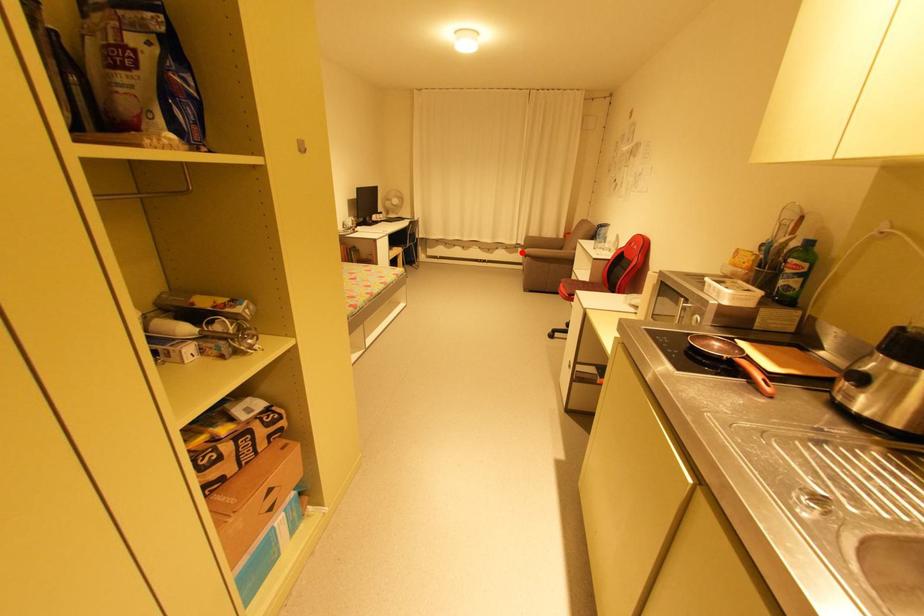
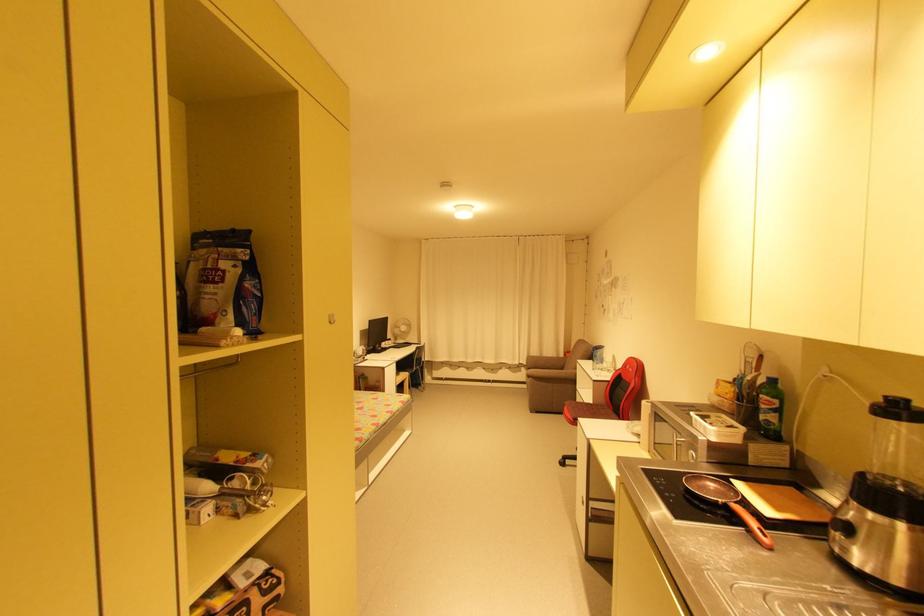
Question: I am providing you with two images of the same scene from different viewpoints. Given a red point in image1, look at the same physical point in image2. Is it:

Choices:
 (A) Closer to the viewpoint
 (B) Farther from the viewpoint

Answer: (B)